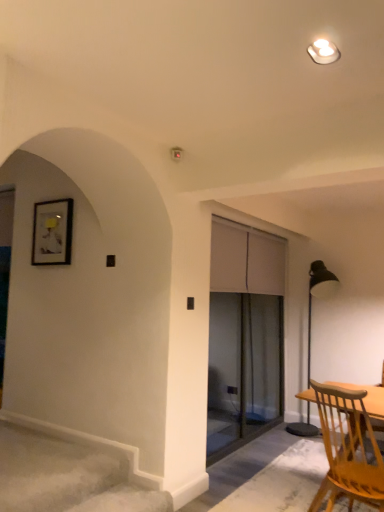
Question: Considering the relative sizes of light brown wooden chair at lower right and white glossy light fixture at upper center in the image provided, is light brown wooden chair at lower right thinner than white glossy light fixture at upper center?

Choices:
 (A) yes
 (B) no

Answer: (B)

Question: Does light brown wooden chair at lower right have a greater width compared to white glossy light fixture at upper center?

Choices:
 (A) yes
 (B) no

Answer: (A)

Question: From the image's perspective, is light brown wooden chair at lower right on top of white glossy light fixture at upper center?

Choices:
 (A) no
 (B) yes

Answer: (A)

Question: Is light brown wooden chair at lower right positioned behind white glossy light fixture at upper center?

Choices:
 (A) yes
 (B) no

Answer: (A)

Question: Could you tell me if light brown wooden chair at lower right is turned towards white glossy light fixture at upper center?

Choices:
 (A) no
 (B) yes

Answer: (A)

Question: From a real-world perspective, is light brown wooden chair at lower right on top of white glossy light fixture at upper center?

Choices:
 (A) no
 (B) yes

Answer: (A)

Question: Considering the relative sizes of light brown wooden chair at lower right and metallic black floor lamp at right in the image provided, is light brown wooden chair at lower right smaller than metallic black floor lamp at right?

Choices:
 (A) no
 (B) yes

Answer: (B)

Question: From the image's perspective, is light brown wooden chair at lower right located beneath metallic black floor lamp at right?

Choices:
 (A) no
 (B) yes

Answer: (B)

Question: Is light brown wooden chair at lower right positioned with its back to metallic black floor lamp at right?

Choices:
 (A) no
 (B) yes

Answer: (A)

Question: Is the position of light brown wooden chair at lower right more distant than that of metallic black floor lamp at right?

Choices:
 (A) no
 (B) yes

Answer: (A)

Question: Would you say metallic black floor lamp at right is part of light brown wooden chair at lower right's contents?

Choices:
 (A) no
 (B) yes

Answer: (A)

Question: Does light brown wooden chair at lower right have a larger size compared to metallic black floor lamp at right?

Choices:
 (A) no
 (B) yes

Answer: (A)

Question: Is metallic black floor lamp at right oriented away from light brown wooden chair at lower right?

Choices:
 (A) no
 (B) yes

Answer: (A)